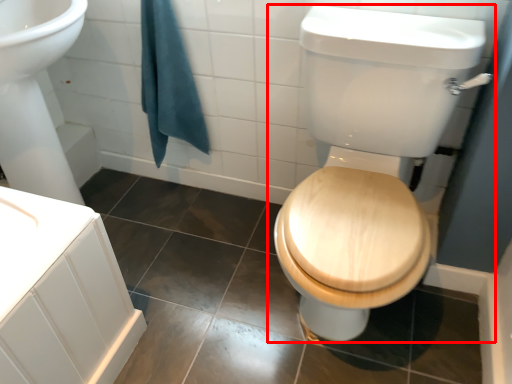
Question: From the image's perspective, what is the correct spatial positioning of toilet (annotated by the red box) in reference to bath towel?

Choices:
 (A) above
 (B) below

Answer: (B)